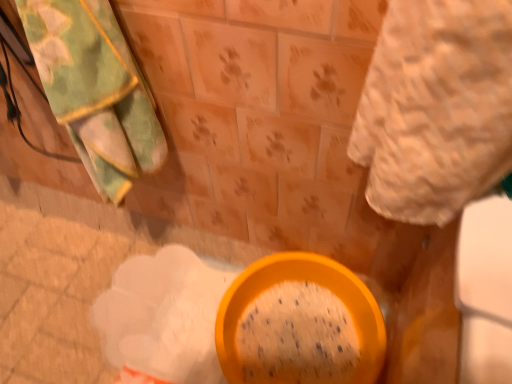
What do you see at coordinates (95, 90) in the screenshot? I see `green textured towel at upper left` at bounding box center [95, 90].

Find the location of a particular element. The height and width of the screenshot is (384, 512). green textured towel at upper left is located at coordinates (95, 90).

The height and width of the screenshot is (384, 512). I want to click on green textured towel at upper left, so click(95, 90).